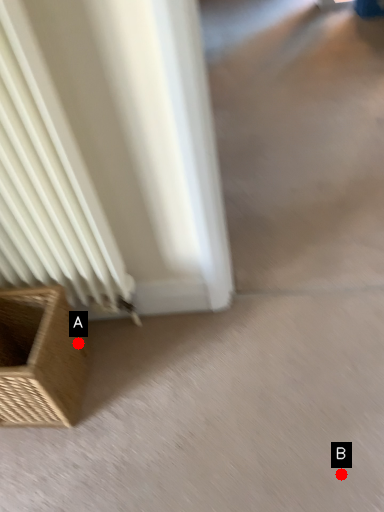
Question: Two points are circled on the image, labeled by A and B beside each circle. Which point is closer to the camera?

Choices:
 (A) A is closer
 (B) B is closer

Answer: (B)